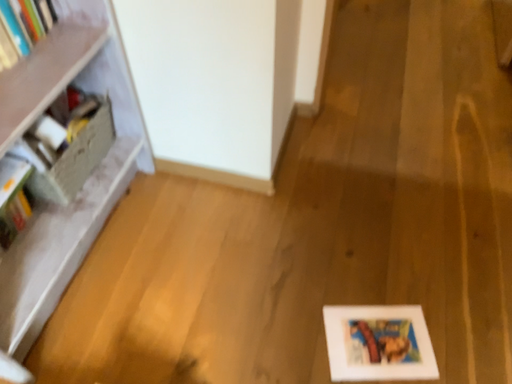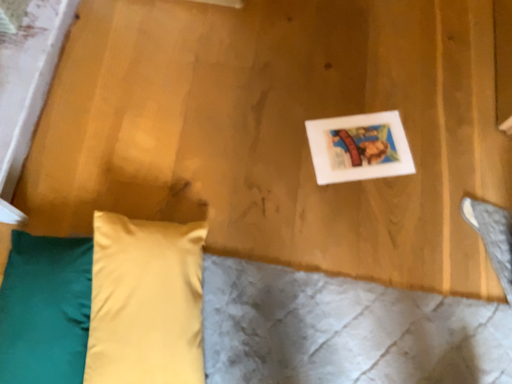
Question: Which way did the camera rotate in the video?

Choices:
 (A) rotated left
 (B) rotated right

Answer: (B)